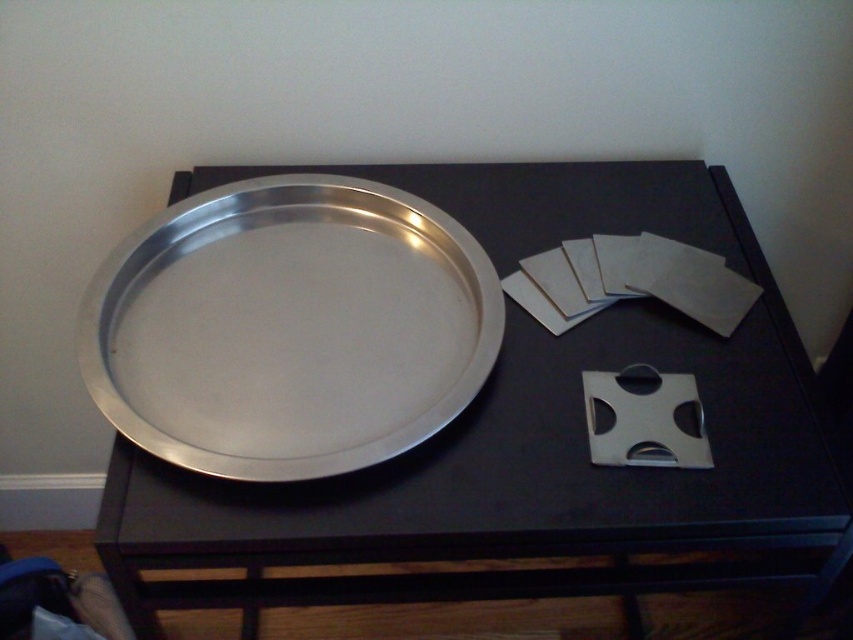
Question: In this image, where is metallic silver tray at center located relative to silver metallic tray at center?

Choices:
 (A) right
 (B) left

Answer: (A)

Question: Among these points, which one is nearest to the camera?

Choices:
 (A) (86, 310)
 (B) (729, 404)

Answer: (B)

Question: Where is metallic silver tray at center located in relation to silver metallic tray at center in the image?

Choices:
 (A) right
 (B) left

Answer: (A)

Question: Is metallic silver tray at center wider than silver metallic tray at center?

Choices:
 (A) no
 (B) yes

Answer: (B)

Question: Which of the following is the farthest from the observer?

Choices:
 (A) (346, 282)
 (B) (733, 227)

Answer: (B)